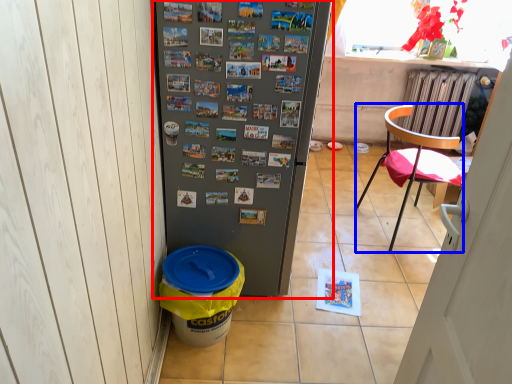
Question: Which point is closer to the camera, refrigerator (highlighted by a red box) or chair (highlighted by a blue box)?

Choices:
 (A) refrigerator
 (B) chair

Answer: (A)